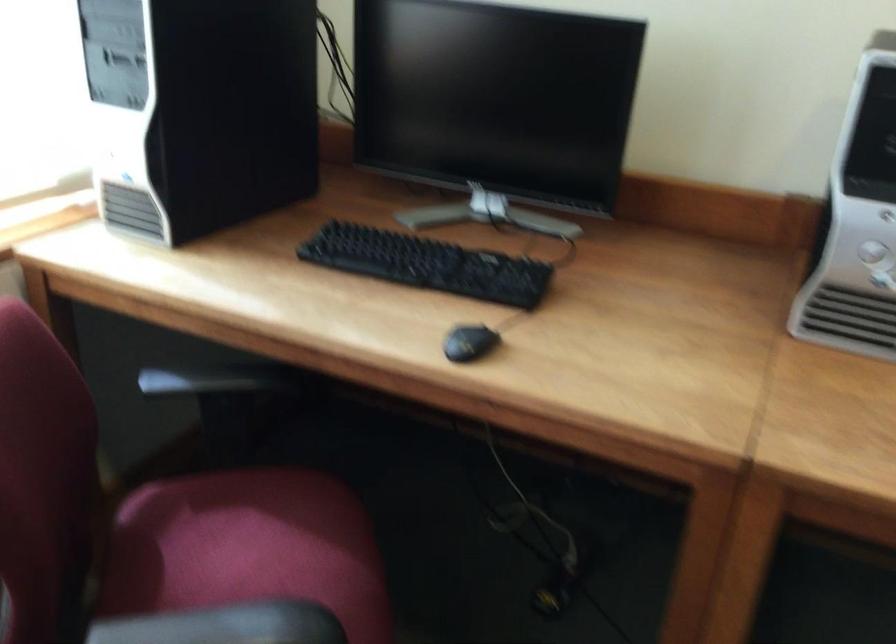
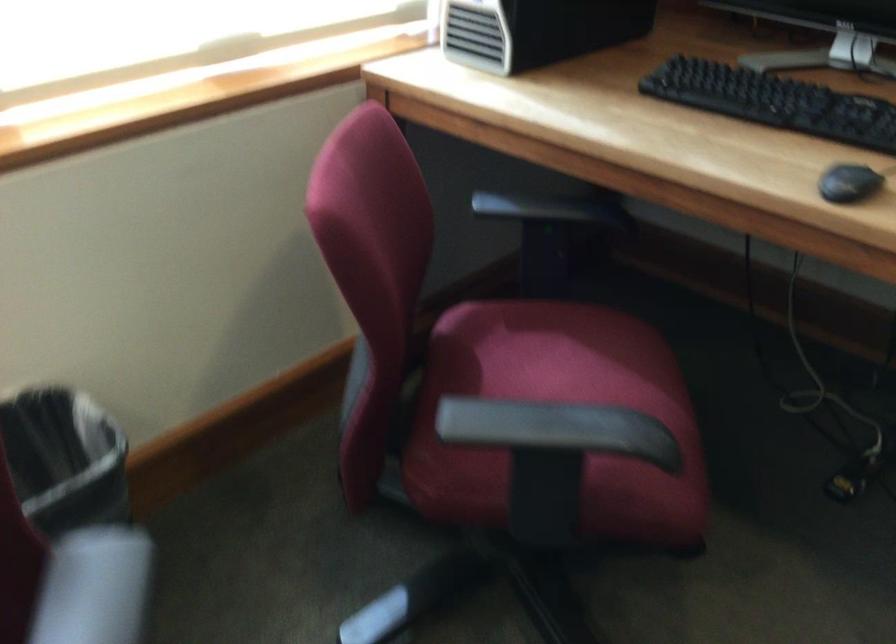
Question: The first image is from the beginning of the video and the second image is from the end. How did the camera likely rotate when shooting the video?

Choices:
 (A) Left
 (B) Right
 (C) Up
 (D) Down

Answer: (A)